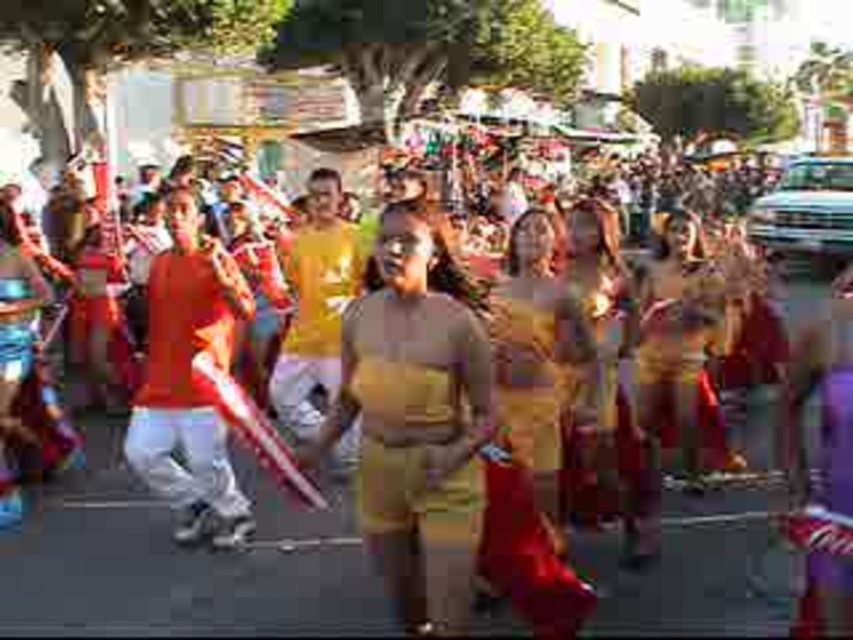
Question: Which point is farther to the camera?

Choices:
 (A) purple matte dress at center
 (B) matte gold skirt at center
 (C) matte red dress at left

Answer: (B)

Question: Which point is closer to the camera?

Choices:
 (A) (421, 336)
 (B) (700, 480)

Answer: (A)

Question: Is matte gold dress at center below matte yellow dress at center?

Choices:
 (A) no
 (B) yes

Answer: (B)

Question: Does matte gold shorts at center have a greater width compared to purple matte dress at center?

Choices:
 (A) yes
 (B) no

Answer: (A)

Question: Which object is the closest to the matte red dress at left?

Choices:
 (A) matte gold shorts at center
 (B) matte gold dress at center
 (C) yellow fabric dress at center

Answer: (A)

Question: Is matte gold shorts at center to the left of matte red dress at left from the viewer's perspective?

Choices:
 (A) yes
 (B) no

Answer: (B)